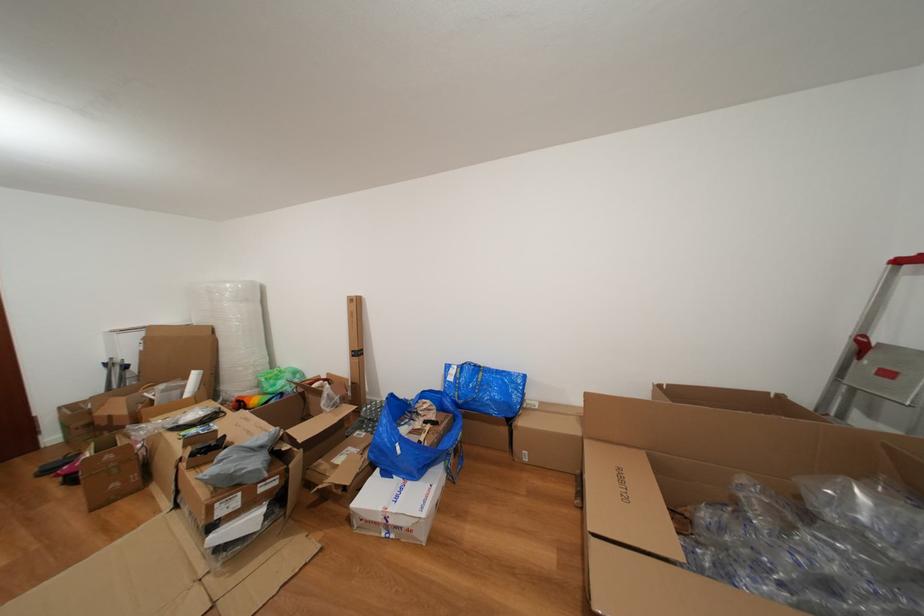
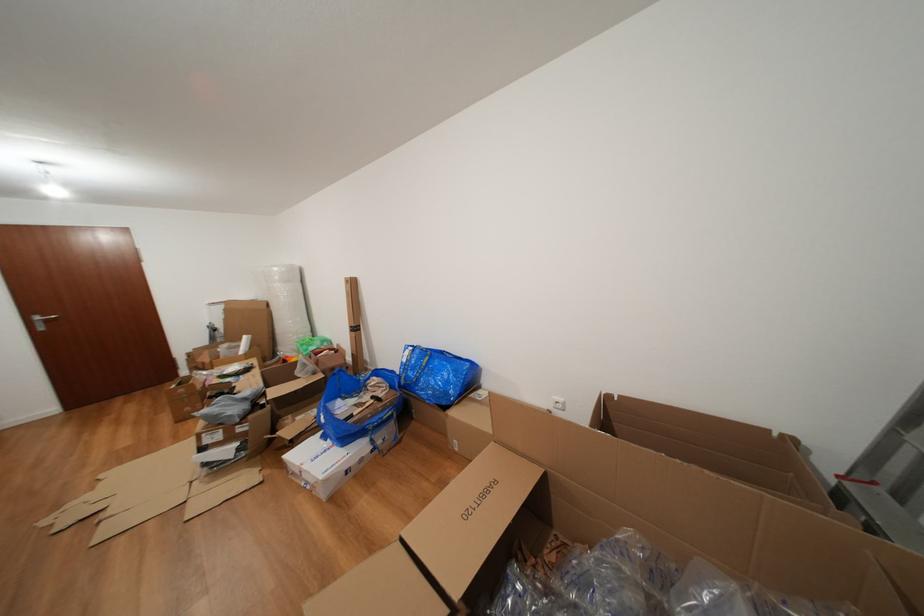
Question: The camera is either moving clockwise (left) or counter-clockwise (right) around the object. The first image is from the beginning of the video and the second image is from the end. Is the camera moving left or right when shooting the video?

Choices:
 (A) Left
 (B) Right

Answer: (B)